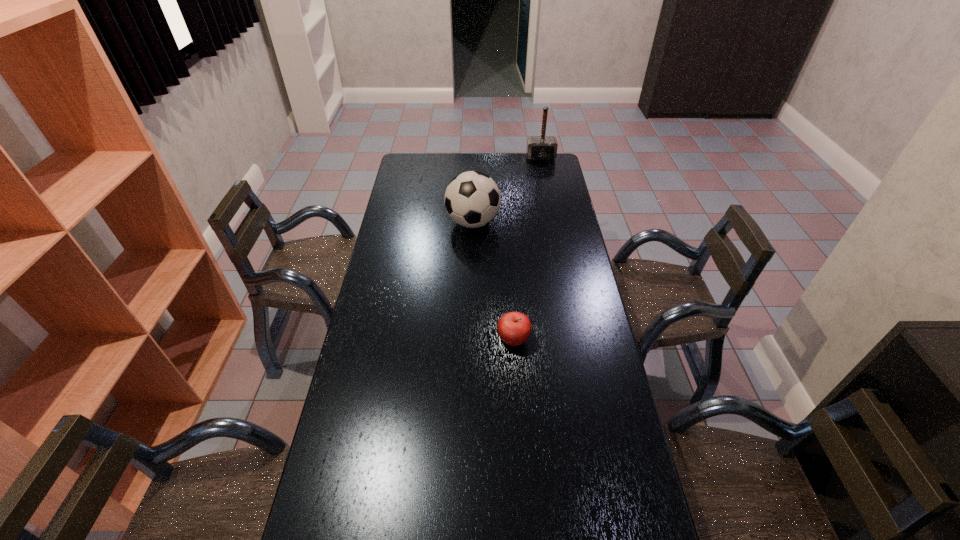
Where is `object located at the right edge`? The height and width of the screenshot is (540, 960). object located at the right edge is located at coordinates (540, 148).

This screenshot has height=540, width=960. What are the coordinates of `object that is at the far right corner` in the screenshot? It's located at (540, 148).

Image resolution: width=960 pixels, height=540 pixels. In the image, there is a desktop. What are the coordinates of `vacant space at the far edge` in the screenshot? It's located at (488, 160).

You are a GUI agent. You are given a task and a screenshot of the screen. Output one action in this format:
    pyautogui.click(x=<x>, y=<y>)
    Task: Click on the vacant region at the left edge of the desktop
    Image resolution: width=960 pixels, height=540 pixels.
    Given the screenshot: What is the action you would take?
    pyautogui.click(x=359, y=501)

This screenshot has height=540, width=960. In the image, there is a desktop. In order to click on vacant space at the right edge in this screenshot , I will do `click(558, 323)`.

Where is `free point between the rightmost object and the nearest object`? free point between the rightmost object and the nearest object is located at coordinates (527, 248).

Where is `free space that is in between the nearest object and the hammer`? Image resolution: width=960 pixels, height=540 pixels. free space that is in between the nearest object and the hammer is located at coordinates (527, 248).

The width and height of the screenshot is (960, 540). What are the coordinates of `free point between the nearest object and the soccer ball` in the screenshot? It's located at (493, 281).

Find the location of a particular element. The image size is (960, 540). free space between the soccer ball and the apple is located at coordinates (493, 281).

Locate which object ranks in proximity to the apple. Please provide its 2D coordinates. Your answer should be formatted as a tuple, i.e. [(x, y)], where the tuple contains the x and y coordinates of a point satisfying the conditions above.

[(472, 199)]